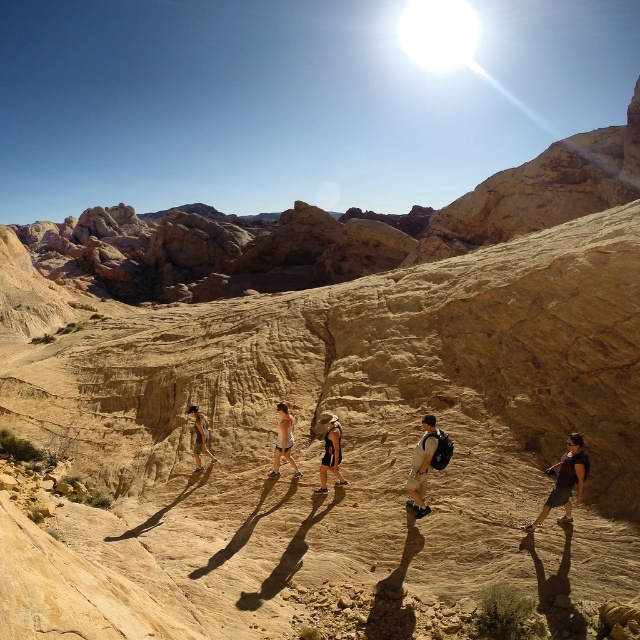
You are a photographer planning to take a photo of the light brown sandal at center and orange and black tank top at center. You want to ensure both are in focus. Given that your camera can only focus on objects within a 20 feet range, will both items be in focus?

The light brown sandal at center is 24.73 feet away from the orange and black tank top at center, which exceeds the 20 feet focus range. Therefore, both items cannot be in focus simultaneously.

You are one of the hikers in the desert scene. You notice a light brown sandal at center and an orange and black tank top at center. Which object is closer to you?

The light brown sandal at center is closer to you because it is in front of the orange and black tank top at center.